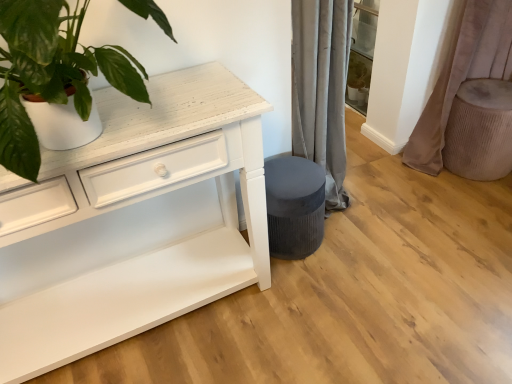
Find the location of a particular element. vacant space that is to the left of beige textured ottoman at right is located at coordinates (420, 189).